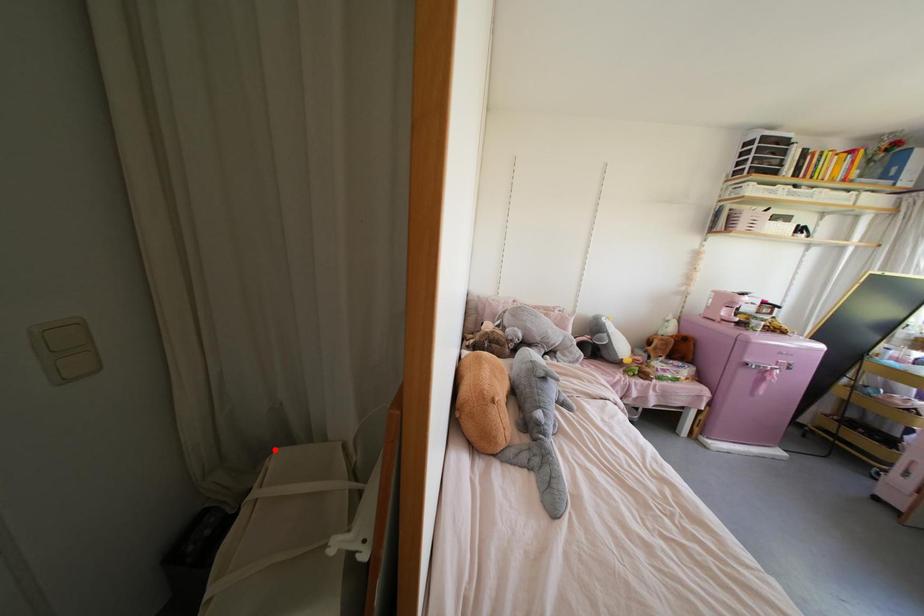
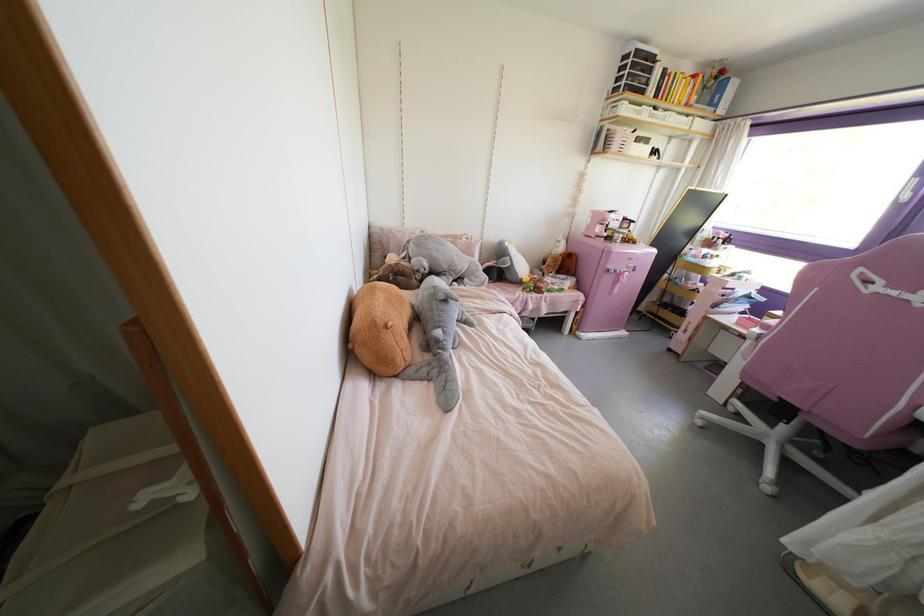
Where in the second image is the point corresponding to the highlighted location from the first image?

(92, 428)